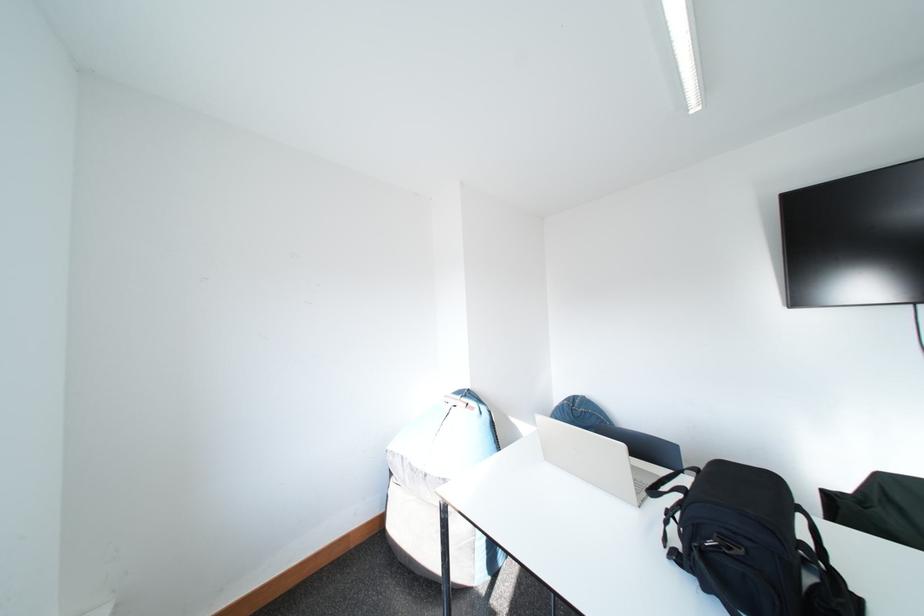
Where is `backpack zipper pull`? The image size is (924, 616). backpack zipper pull is located at coordinates (724, 545).